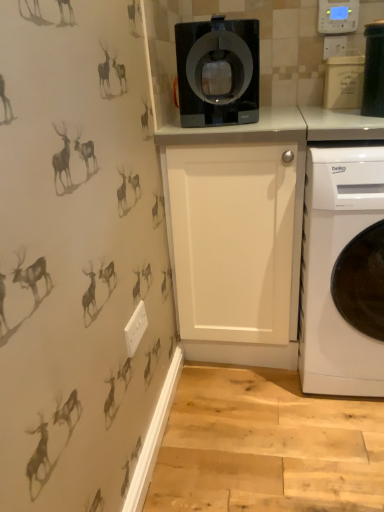
Question: Considering the relative sizes of black plastic container at upper right, marked as the 1th appliance in a front-to-back arrangement, and white glossy cabinet at center in the image provided, is black plastic container at upper right, marked as the 1th appliance in a front-to-back arrangement, wider than white glossy cabinet at center?

Choices:
 (A) yes
 (B) no

Answer: (B)

Question: Is black plastic container at upper right, marked as the 1th appliance in a front-to-back arrangement, smaller than white glossy cabinet at center?

Choices:
 (A) no
 (B) yes

Answer: (B)

Question: Is black plastic container at upper right, placed as the 2th appliance when sorted from back to front, aimed at white glossy cabinet at center?

Choices:
 (A) no
 (B) yes

Answer: (A)

Question: Is black plastic container at upper right, marked as the 1th appliance in a front-to-back arrangement, not near white glossy cabinet at center?

Choices:
 (A) no
 (B) yes

Answer: (A)

Question: From a real-world perspective, is black plastic container at upper right, placed as the 2th appliance when sorted from back to front, physically above white glossy cabinet at center?

Choices:
 (A) no
 (B) yes

Answer: (B)

Question: Considering the relative sizes of black plastic container at upper right, placed as the 2th appliance when sorted from back to front, and white glossy cabinet at center in the image provided, is black plastic container at upper right, placed as the 2th appliance when sorted from back to front, shorter than white glossy cabinet at center?

Choices:
 (A) yes
 (B) no

Answer: (A)

Question: Is black glossy coffee machine at upper center in front of white glossy cabinet at center?

Choices:
 (A) no
 (B) yes

Answer: (B)

Question: Does black glossy coffee machine at upper center have a smaller size compared to white glossy cabinet at center?

Choices:
 (A) no
 (B) yes

Answer: (B)

Question: Is the depth of black glossy coffee machine at upper center greater than that of white glossy cabinet at center?

Choices:
 (A) yes
 (B) no

Answer: (B)

Question: Can you confirm if black glossy coffee machine at upper center is thinner than white glossy cabinet at center?

Choices:
 (A) yes
 (B) no

Answer: (A)

Question: Does black glossy coffee machine at upper center touch white glossy cabinet at center?

Choices:
 (A) no
 (B) yes

Answer: (A)

Question: From a real-world perspective, is black glossy coffee machine at upper center below white glossy cabinet at center?

Choices:
 (A) no
 (B) yes

Answer: (A)

Question: From a real-world perspective, does white matte container at upper right, which is counted as the second appliance, starting from the front, sit lower than white glossy washing machine at lower right?

Choices:
 (A) no
 (B) yes

Answer: (A)